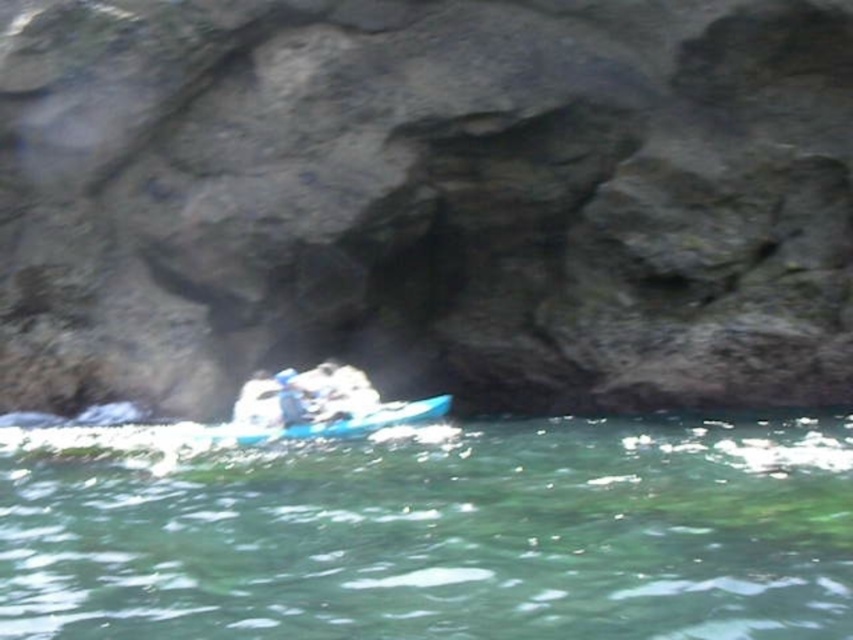
Between point (708, 227) and point (149, 440), which one is positioned in front?

Point (149, 440) is in front.

Is black rock at center to the left of green translucent water at center from the viewer's perspective?

Correct, you'll find black rock at center to the left of green translucent water at center.

This screenshot has height=640, width=853. Describe the element at coordinates (426, 200) in the screenshot. I see `black rock at center` at that location.

Identify the location of black rock at center. (426, 200).

Does green translucent water at center have a smaller size compared to blue plastic kayak at lower center?

No, green translucent water at center is not smaller than blue plastic kayak at lower center.

Based on the photo, can you confirm if green translucent water at center is wider than blue plastic kayak at lower center?

Yes.

Locate an element on the screen. green translucent water at center is located at coordinates (432, 532).

Between black rock at center and blue plastic kayak at lower center, which one appears on the left side from the viewer's perspective?

Positioned to the left is blue plastic kayak at lower center.

Does black rock at center have a greater width compared to blue plastic kayak at lower center?

Indeed, black rock at center has a greater width compared to blue plastic kayak at lower center.

At what (x,y) coordinates should I click in order to perform the action: click on black rock at center. Please return your answer as a coordinate pair (x, y). The width and height of the screenshot is (853, 640). Looking at the image, I should click on (426, 200).